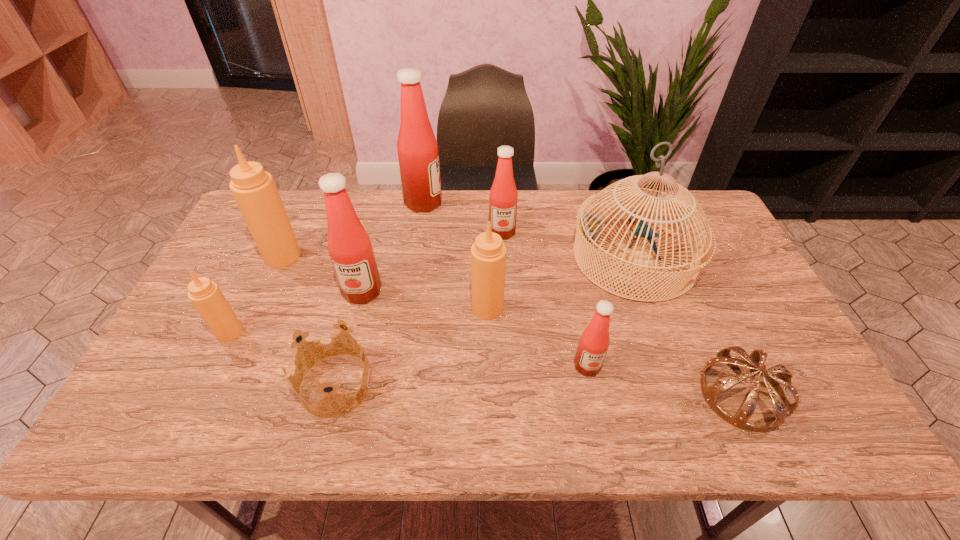
The height and width of the screenshot is (540, 960). I want to click on blank area located 0.070m on the left of the birdcage, so click(549, 258).

In order to click on vacant space located on the back of the rightmost tan condiment in this screenshot , I will do `click(487, 268)`.

You are a GUI agent. You are given a task and a screenshot of the screen. Output one action in this format:
    pyautogui.click(x=<x>, y=<y>)
    Task: Click on the vacant space located 0.290m on the front-facing side of the third red condiment from left to right
    
    Given the screenshot: What is the action you would take?
    pyautogui.click(x=506, y=312)

Where is `free space located 0.060m on the left of the nearest tan condiment`? Image resolution: width=960 pixels, height=540 pixels. free space located 0.060m on the left of the nearest tan condiment is located at coordinates (195, 332).

I want to click on vacant region located on the front-facing side of the rightmost red condiment, so click(594, 400).

Where is `blank space located on the right of the crown`? blank space located on the right of the crown is located at coordinates (466, 385).

This screenshot has height=540, width=960. What are the coordinates of `vacant space situated on the left of the brown tiara` in the screenshot? It's located at (541, 395).

Locate an element on the screen. This screenshot has width=960, height=540. birdcage present at the far edge is located at coordinates (589, 228).

Locate an element on the screen. crown that is at the near edge is located at coordinates (316, 341).

Identify the location of tiara at the near edge. This screenshot has height=540, width=960. (782, 407).